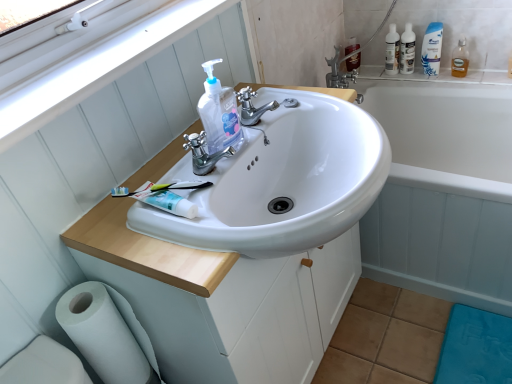
Identify the location of free space in front of clear plastic bottle at upper right. The width and height of the screenshot is (512, 384). (411, 73).